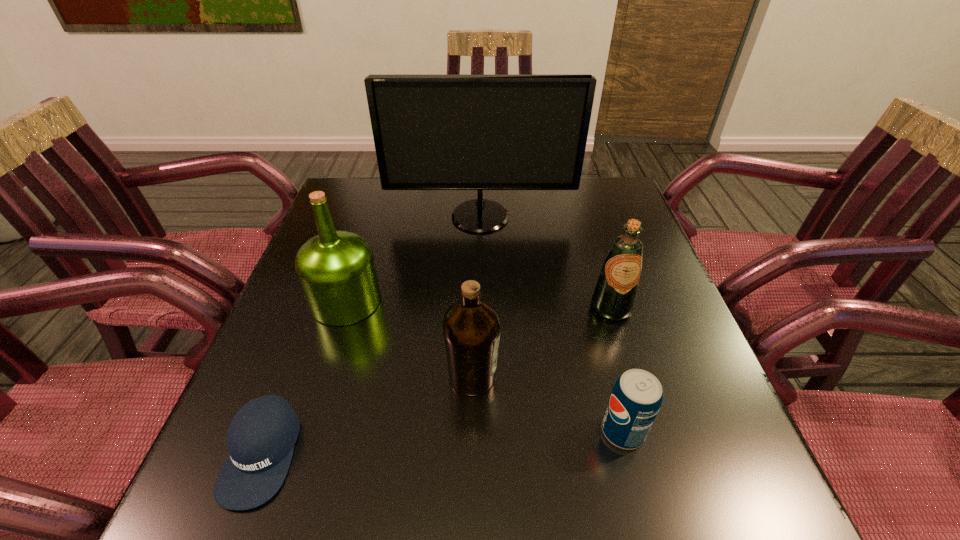
The image size is (960, 540). Identify the location of vacant area that lies between the baseball cap and the nearest olive oil. (367, 415).

Locate an element on the screen. vacant point located between the pop and the third nearest object is located at coordinates (547, 404).

The image size is (960, 540). In order to click on empty location between the leftmost olive oil and the second olive oil from left to right in this screenshot , I will do `click(409, 339)`.

Find the location of a particular element. free space between the shortest object and the fourth farthest object is located at coordinates (367, 415).

Find the location of a particular element. The width and height of the screenshot is (960, 540). the fifth closest object to the second olive oil from right to left is located at coordinates (431, 132).

Point out which object is positioned as the nearest to the farthest object. Please provide its 2D coordinates. Your answer should be formatted as a tuple, i.e. [(x, y)], where the tuple contains the x and y coordinates of a point satisfying the conditions above.

[(336, 270)]

This screenshot has height=540, width=960. I want to click on olive oil that is the second closest to the rightmost olive oil, so click(336, 270).

Select which olive oil is the second closest to the shortest object. Please provide its 2D coordinates. Your answer should be formatted as a tuple, i.e. [(x, y)], where the tuple contains the x and y coordinates of a point satisfying the conditions above.

[(471, 327)]

The height and width of the screenshot is (540, 960). Find the location of `free space that satisfies the following two spatial constraints: 1. on the front-facing side of the pop; 2. on the right side of the tallest object`. free space that satisfies the following two spatial constraints: 1. on the front-facing side of the pop; 2. on the right side of the tallest object is located at coordinates click(x=481, y=431).

Identify the location of vacant space that satisfies the following two spatial constraints: 1. on the label of the fourth farthest object; 2. on the front-facing side of the baseball cap. (471, 454).